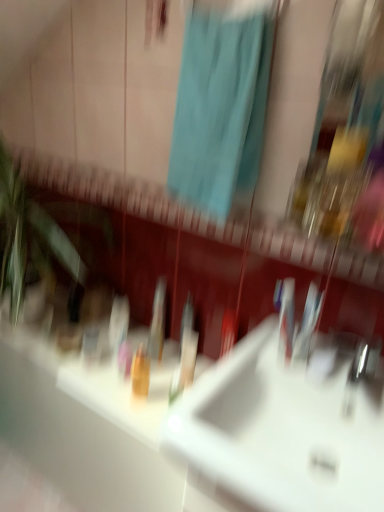
Question: Is translucent orange bottle at center bigger than white glossy sink at center?

Choices:
 (A) no
 (B) yes

Answer: (A)

Question: Is translucent orange bottle at center wider than white glossy sink at center?

Choices:
 (A) no
 (B) yes

Answer: (A)

Question: Is translucent orange bottle at center positioned before white glossy sink at center?

Choices:
 (A) yes
 (B) no

Answer: (B)

Question: Does translucent orange bottle at center have a lesser height compared to white glossy sink at center?

Choices:
 (A) yes
 (B) no

Answer: (B)

Question: From the image's perspective, is translucent orange bottle at center on top of white glossy sink at center?

Choices:
 (A) yes
 (B) no

Answer: (B)

Question: Is translucent orange bottle at center positioned far away from white glossy sink at center?

Choices:
 (A) no
 (B) yes

Answer: (A)

Question: Considering the relative sizes of translucent plastic toothbrush at center and translucent orange bottle at center in the image provided, is translucent plastic toothbrush at center wider than translucent orange bottle at center?

Choices:
 (A) no
 (B) yes

Answer: (A)

Question: Can we say translucent plastic toothbrush at center lies outside translucent orange bottle at center?

Choices:
 (A) no
 (B) yes

Answer: (B)

Question: Is translucent orange bottle at center surrounded by translucent plastic toothbrush at center?

Choices:
 (A) yes
 (B) no

Answer: (B)

Question: From a real-world perspective, is translucent plastic toothbrush at center beneath translucent orange bottle at center?

Choices:
 (A) no
 (B) yes

Answer: (A)

Question: From a real-world perspective, does translucent plastic toothbrush at center stand above translucent orange bottle at center?

Choices:
 (A) no
 (B) yes

Answer: (B)

Question: From the image's perspective, is translucent plastic toothbrush at center under translucent orange bottle at center?

Choices:
 (A) yes
 (B) no

Answer: (B)

Question: Is teal fabric shower curtain at upper center aimed at translucent orange bottle at center?

Choices:
 (A) no
 (B) yes

Answer: (A)